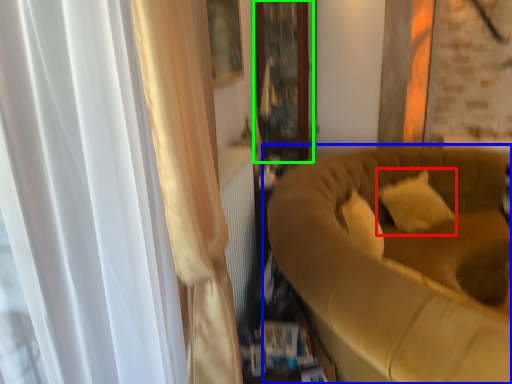
Question: Estimate the real-world distances between objects in this image. Which object is farther from pillow (highlighted by a red box), studio couch (highlighted by a blue box) or glass door (highlighted by a green box)?

Choices:
 (A) studio couch
 (B) glass door

Answer: (B)